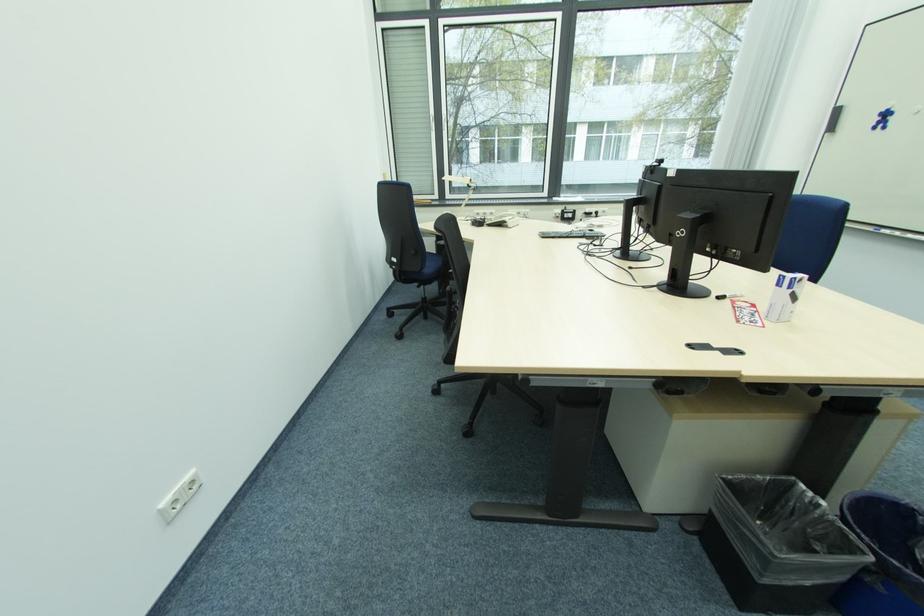
Which object does [568,351] point to?

It refers to a black computer keyboard.